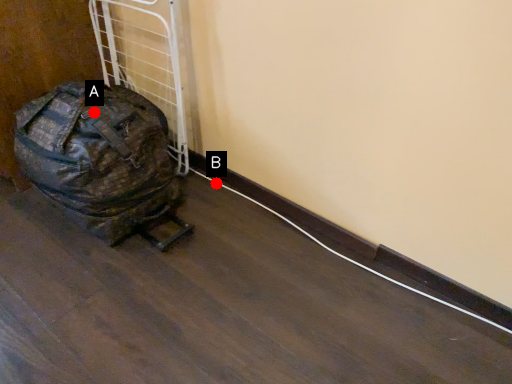
Question: Two points are circled on the image, labeled by A and B beside each circle. Which point is farther from the camera taking this photo?

Choices:
 (A) A is further
 (B) B is further

Answer: (B)